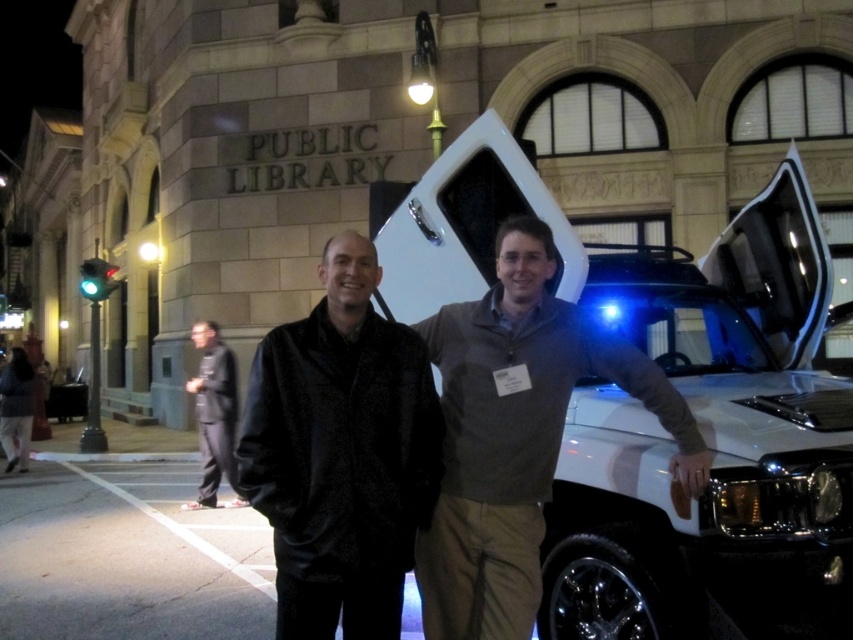
Question: Is white glossy suv at right above matte black jacket at center?

Choices:
 (A) no
 (B) yes

Answer: (B)

Question: Which point is closer to the camera?

Choices:
 (A) black textured jacket at center
 (B) matte black jacket at center

Answer: (A)

Question: In this image, where is white glossy suv at right located relative to black textured jacket at center?

Choices:
 (A) right
 (B) left

Answer: (A)

Question: Which point appears farthest from the camera in this image?

Choices:
 (A) (229, 433)
 (B) (334, 572)

Answer: (A)

Question: Is matte black jacket at center above black textured jacket at center?

Choices:
 (A) no
 (B) yes

Answer: (A)

Question: Which point is closer to the camera?

Choices:
 (A) (335, 316)
 (B) (213, 323)
 (C) (751, 337)
 (D) (426, 484)

Answer: (A)